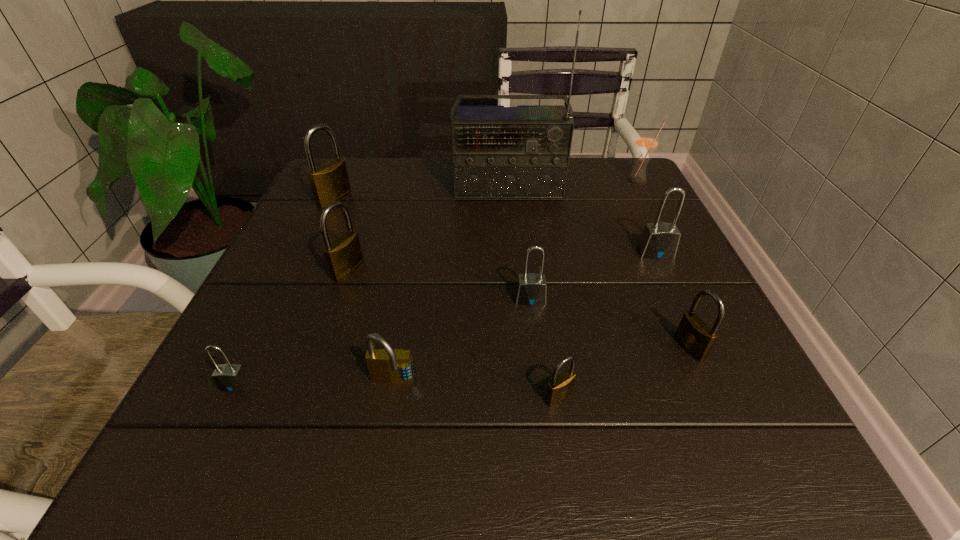
At what (x,y) coordinates should I click in order to perform the action: click on straw at the far edge. Please return your answer as a coordinate pair (x, y). This screenshot has width=960, height=540. Looking at the image, I should click on (646, 142).

Image resolution: width=960 pixels, height=540 pixels. Find the location of `straw located at the right edge`. straw located at the right edge is located at coordinates (646, 142).

Where is `object that is positioned at the far left corner`? This screenshot has height=540, width=960. object that is positioned at the far left corner is located at coordinates (329, 182).

I want to click on object that is at the far right corner, so click(x=646, y=142).

The width and height of the screenshot is (960, 540). Identify the location of free space at the far edge. (395, 176).

Identify the location of vacant area at the near edge. This screenshot has width=960, height=540. (324, 461).

Image resolution: width=960 pixels, height=540 pixels. I want to click on blank space at the left edge, so click(270, 382).

Identify the location of vacant area at the right edge. The image size is (960, 540). click(x=696, y=273).

Find the location of `free space at the far right corner of the desktop`. free space at the far right corner of the desktop is located at coordinates (629, 205).

Find the location of `free space that is in between the farthest padlock and the farthest gray padlock`. free space that is in between the farthest padlock and the farthest gray padlock is located at coordinates (495, 226).